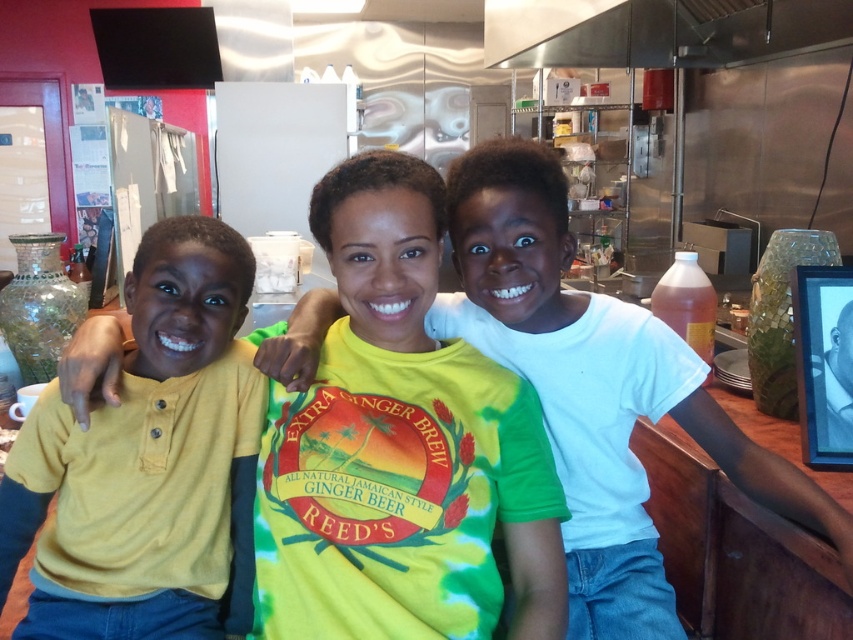
Is the position of yellow cotton shirt at center less distant than that of white matte shirt at center?

That is True.

Is point (346, 188) closer to viewer compared to point (549, 289)?

Yes, point (346, 188) is closer to viewer.

Which is behind, point (361, 465) or point (547, 371)?

Point (547, 371)

This screenshot has height=640, width=853. In order to click on yellow cotton shirt at center in this screenshot , I will do `click(403, 445)`.

From the picture: Who is positioned more to the left, yellow cotton shirt at center or yellow cotton shirt at left?

yellow cotton shirt at left is more to the left.

Is yellow cotton shirt at center shorter than yellow cotton shirt at left?

Incorrect, yellow cotton shirt at center's height does not fall short of yellow cotton shirt at left's.

Where is `yellow cotton shirt at center`? yellow cotton shirt at center is located at coordinates (403, 445).

You are a GUI agent. You are given a task and a screenshot of the screen. Output one action in this format:
    pyautogui.click(x=<x>, y=<y>)
    Task: Click on the yellow cotton shirt at center
    The image size is (853, 640).
    Given the screenshot: What is the action you would take?
    pyautogui.click(x=403, y=445)

Consider the image. Who is more distant from viewer, (604, 486) or (712, 28)?

Positioned behind is point (712, 28).

Where is `white matte shirt at center`? The width and height of the screenshot is (853, 640). white matte shirt at center is located at coordinates (595, 387).

Where is `white matte shirt at center`? white matte shirt at center is located at coordinates (595, 387).